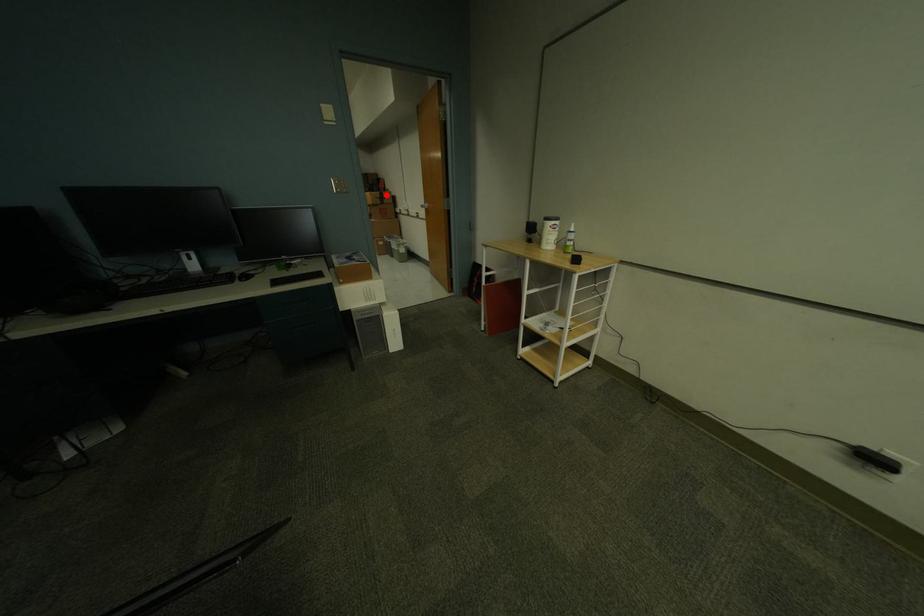
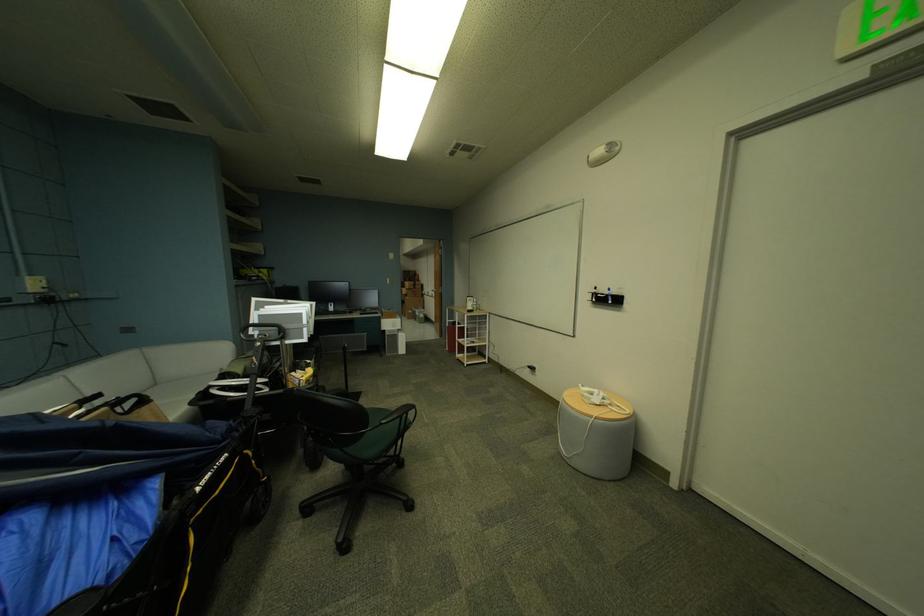
Question: I am providing you with two images of the same scene from different viewpoints. A red point is shown in image1. For the corresponding object point in image2, is it positioned nearer or farther from the camera?

Choices:
 (A) Nearer
 (B) Farther

Answer: (B)